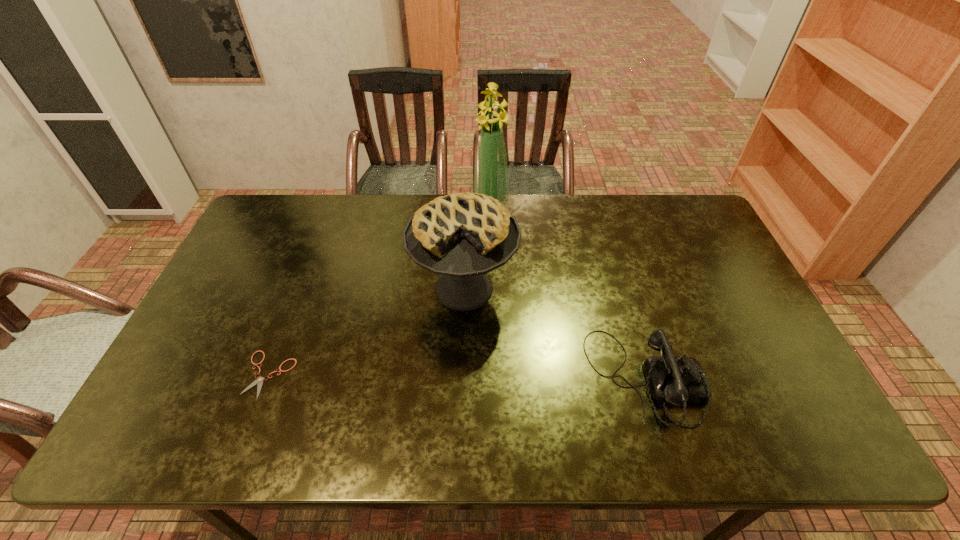
This screenshot has width=960, height=540. In order to click on the leftmost object in this screenshot , I will do `click(259, 380)`.

Locate an element on the screen. shears is located at coordinates (259, 380).

In order to click on the rightmost object in this screenshot , I will do `click(677, 380)`.

Locate an element on the screen. telephone is located at coordinates (677, 380).

Where is `bouquet`? This screenshot has height=540, width=960. bouquet is located at coordinates (491, 175).

The height and width of the screenshot is (540, 960). In order to click on the tallest object in this screenshot , I will do `click(491, 175)`.

Where is `the second tallest object`? the second tallest object is located at coordinates (462, 236).

Where is `free region located on the back of the leftmost object`? This screenshot has width=960, height=540. free region located on the back of the leftmost object is located at coordinates (296, 305).

Where is `free space located on the front-facing side of the second shortest object`? This screenshot has width=960, height=540. free space located on the front-facing side of the second shortest object is located at coordinates (755, 380).

Locate an element on the screen. This screenshot has width=960, height=540. free space located 0.320m on the front-facing side of the bouquet is located at coordinates (474, 282).